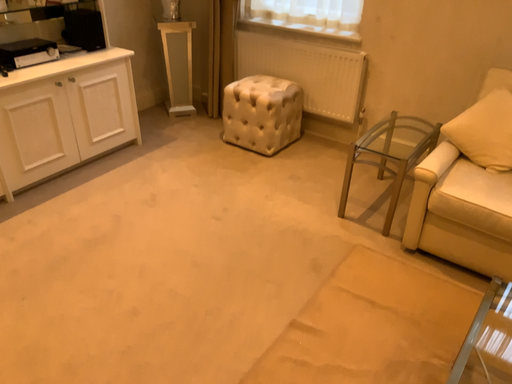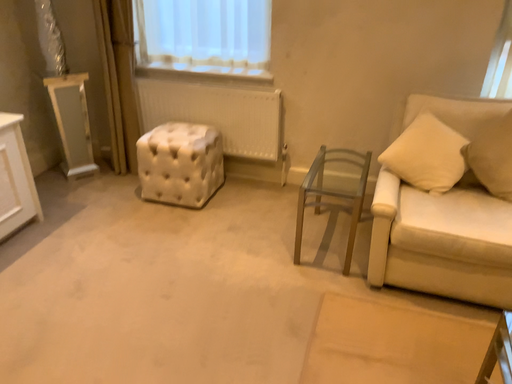
Question: How did the camera likely rotate when shooting the video?

Choices:
 (A) rotated right
 (B) rotated left

Answer: (A)